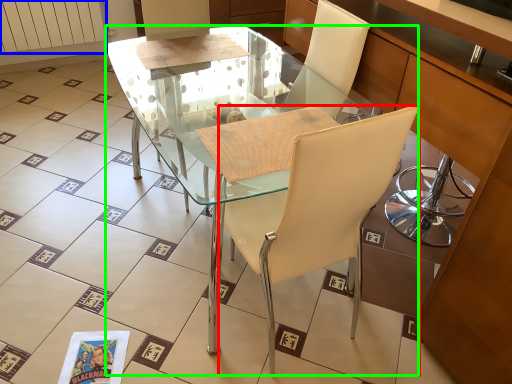
Question: Which is nearer to the chair (highlighted by a red box)? radiator (highlighted by a blue box) or desk (highlighted by a green box).

Choices:
 (A) radiator
 (B) desk

Answer: (B)